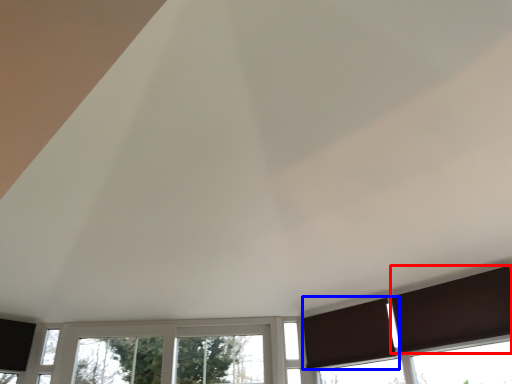
Question: Which of the following is the farthest to the observer, curtain (highlighted by a red box) or curtain (highlighted by a blue box)?

Choices:
 (A) curtain
 (B) curtain

Answer: (B)